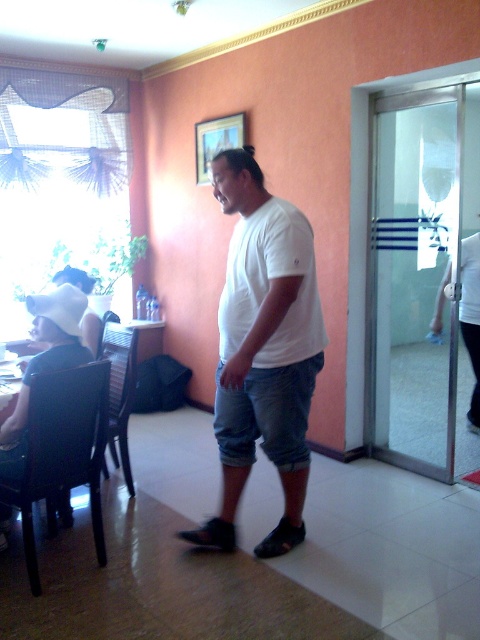
Question: Among these objects, which one is farthest from the camera?

Choices:
 (A) white matte t-shirt at center
 (B) transparent glass door at right

Answer: (B)

Question: Can you confirm if transparent glass door at right is positioned to the right of white matte t-shirt at center?

Choices:
 (A) yes
 (B) no

Answer: (A)

Question: Is transparent glass door at right behind white matte t-shirt at center?

Choices:
 (A) yes
 (B) no

Answer: (A)

Question: Does transparent glass door at right appear on the right side of white matte t-shirt at center?

Choices:
 (A) no
 (B) yes

Answer: (B)

Question: Among these objects, which one is nearest to the camera?

Choices:
 (A) transparent glass door at right
 (B) white matte t-shirt at center

Answer: (B)